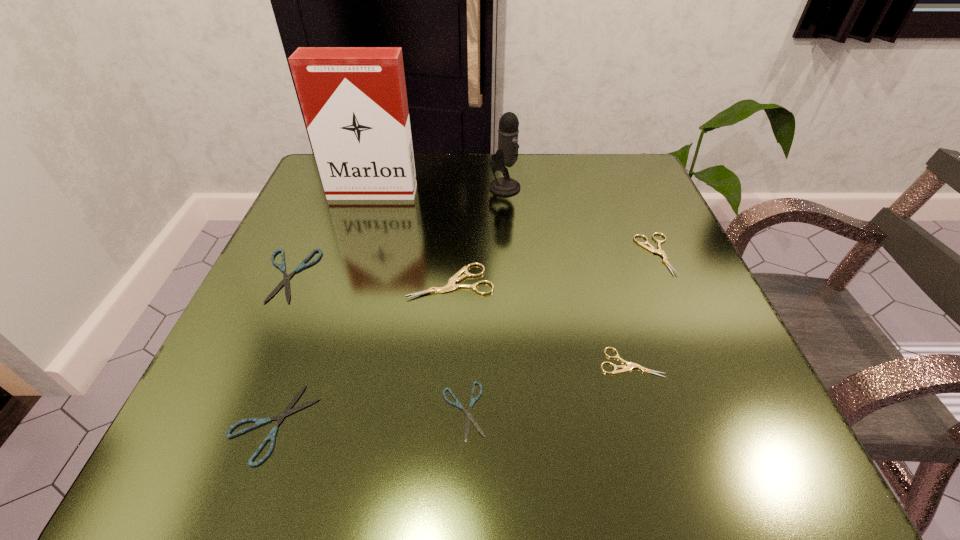
Where is `vacant space situated on the right of the second biggest black shears`? This screenshot has height=540, width=960. vacant space situated on the right of the second biggest black shears is located at coordinates (550, 423).

You are a GUI agent. You are given a task and a screenshot of the screen. Output one action in this format:
    pyautogui.click(x=<x>, y=<y>)
    Task: Click on the vacant area situated 0.170m on the left of the rightmost black shears
    
    Given the screenshot: What is the action you would take?
    pyautogui.click(x=315, y=410)

Where is `cigarette_case that is at the far edge`? Image resolution: width=960 pixels, height=540 pixels. cigarette_case that is at the far edge is located at coordinates (354, 101).

Locate an element on the screen. The width and height of the screenshot is (960, 540). microphone at the far edge is located at coordinates (507, 154).

Identify the location of cigarette_case located in the left edge section of the desktop. This screenshot has width=960, height=540. (x=354, y=101).

At what (x,y) coordinates should I click in order to perform the action: click on object present at the far left corner. Please return your answer as a coordinate pair (x, y). This screenshot has width=960, height=540. Looking at the image, I should click on (354, 101).

Find the location of a particular element. This screenshot has height=540, width=960. object positioned at the near left corner is located at coordinates (287, 411).

I want to click on free space at the far edge of the desktop, so click(x=578, y=199).

Where is `vacant region at the near edge of the desktop`? The width and height of the screenshot is (960, 540). vacant region at the near edge of the desktop is located at coordinates (542, 475).

Find the location of a particular element. The width and height of the screenshot is (960, 540). vacant space at the left edge of the desktop is located at coordinates (312, 327).